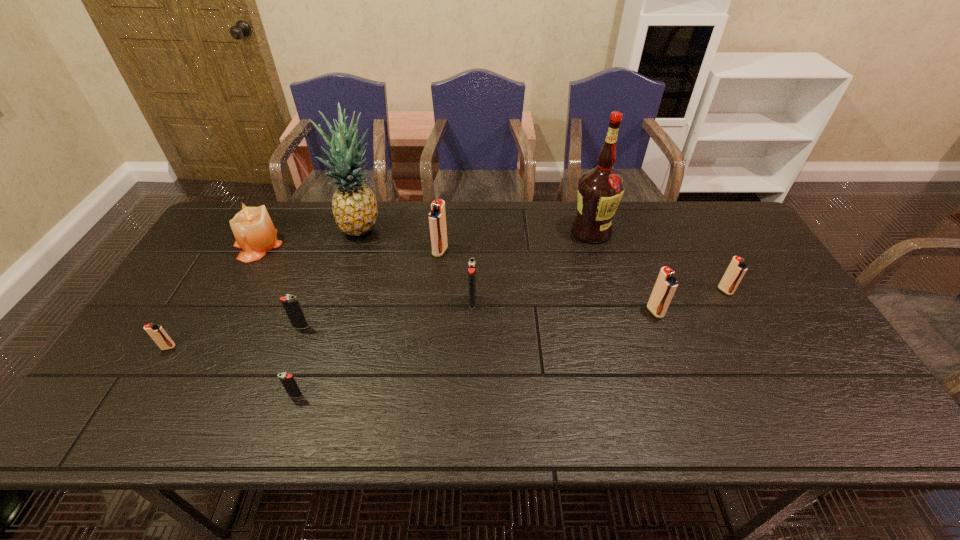
This screenshot has height=540, width=960. Identify the location of vacant area at the far right corner. (720, 233).

Identify the location of vacant region between the second biggest red igniter and the second biggest black igniter. (478, 319).

I want to click on vacant space that is in between the third igniter from right to left and the yellow pineapple, so click(418, 265).

You are a GUI agent. You are given a task and a screenshot of the screen. Output one action in this format:
    pyautogui.click(x=<x>, y=<y>)
    Task: Click on the vacant area that lies between the brown alcohol and the second nearest black igniter
    Image resolution: width=960 pixels, height=540 pixels.
    Given the screenshot: What is the action you would take?
    pyautogui.click(x=445, y=279)

You are a GUI agent. You are given a task and a screenshot of the screen. Output one action in this format:
    pyautogui.click(x=<x>, y=<y>)
    Task: Click on the unoccupied area between the farthest red igniter and the ninth farthest object
    This screenshot has width=960, height=540.
    Given the screenshot: What is the action you would take?
    pyautogui.click(x=304, y=299)

Where is `free point between the leftmost red igniter and the brown alcohol`? free point between the leftmost red igniter and the brown alcohol is located at coordinates (380, 289).

Where is `empty location between the beige candle and the second red igniter from left to right`? The image size is (960, 540). empty location between the beige candle and the second red igniter from left to right is located at coordinates (348, 248).

Where is `free area in between the biggest black igniter and the rightmost igniter`? Image resolution: width=960 pixels, height=540 pixels. free area in between the biggest black igniter and the rightmost igniter is located at coordinates click(x=599, y=296).

Locate an element on the screen. The width and height of the screenshot is (960, 540). vacant region between the second black igniter from right to left and the ninth farthest object is located at coordinates (232, 372).

Find the location of `unoccupied position between the third smallest red igniter and the second black igniter from left to right`. unoccupied position between the third smallest red igniter and the second black igniter from left to right is located at coordinates (475, 354).